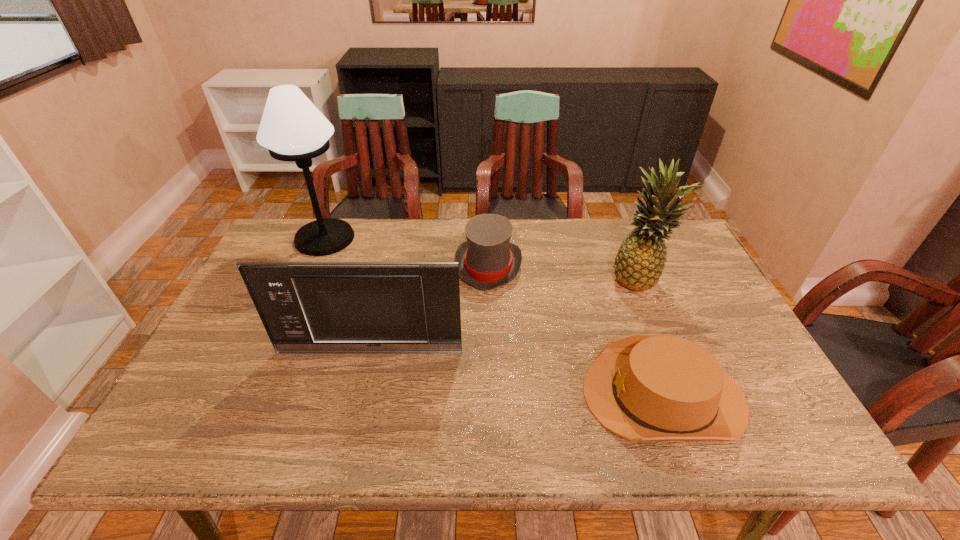
You are a GUI agent. You are given a task and a screenshot of the screen. Output one action in this format:
    pyautogui.click(x=<x>, y=<y>)
    Task: Click on the object situated at the far right corner
    The height and width of the screenshot is (540, 960).
    Given the screenshot: What is the action you would take?
    pyautogui.click(x=640, y=260)

Identify the location of object at the near right corner. The height and width of the screenshot is (540, 960). tap(643, 387).

You are a GUI agent. You are given a task and a screenshot of the screen. Output one action in this format:
    pyautogui.click(x=<x>, y=<y>)
    Task: Click on the vacant area at the far edge of the desktop
    This screenshot has width=960, height=540.
    Given the screenshot: What is the action you would take?
    pyautogui.click(x=454, y=243)

The width and height of the screenshot is (960, 540). I want to click on vacant area at the left edge, so click(x=259, y=320).

This screenshot has width=960, height=540. Identify the location of vacant space at the right edge of the desktop. (686, 327).

This screenshot has width=960, height=540. What are the coordinates of `vacant space at the far left corner of the desktop` in the screenshot? It's located at (308, 224).

Identify the location of vacant space at the near left corner. (180, 449).

Where is `free space between the cowboy hat and the dress hat`? Image resolution: width=960 pixels, height=540 pixels. free space between the cowboy hat and the dress hat is located at coordinates (576, 330).

Locate an element on the screen. This screenshot has height=540, width=960. vacant area between the pineapple and the second shortest object is located at coordinates (564, 272).

Locate an element on the screen. This screenshot has width=960, height=540. free space that is in between the fourth shortest object and the third shortest object is located at coordinates (504, 315).